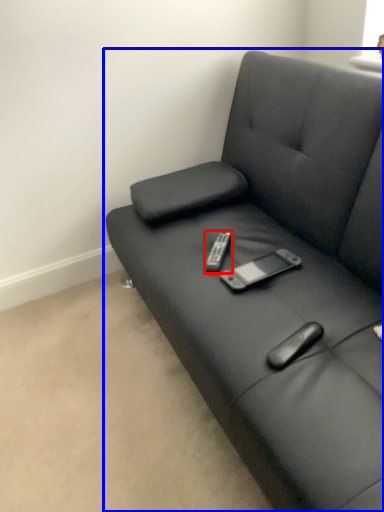
Question: Among these objects, which one is farthest to the camera, remote (highlighted by a red box) or studio couch (highlighted by a blue box)?

Choices:
 (A) remote
 (B) studio couch

Answer: (A)